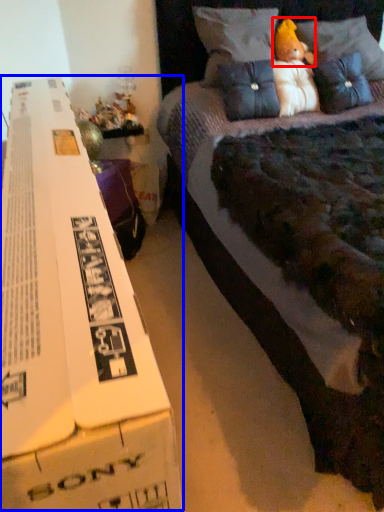
Question: Which object appears closest to the camera in this image, toy (highlighted by a red box) or paperback book (highlighted by a blue box)?

Choices:
 (A) toy
 (B) paperback book

Answer: (B)